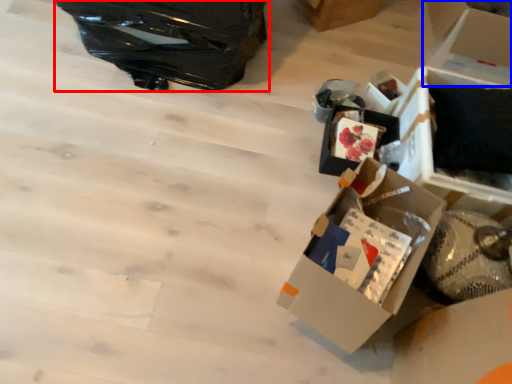
Question: Which object is closer to the camera taking this photo, suitcase (highlighted by a red box) or cardboard box (highlighted by a blue box)?

Choices:
 (A) suitcase
 (B) cardboard box

Answer: (A)